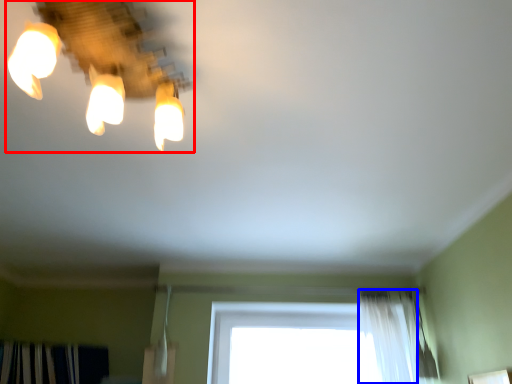
Question: Which object is further to the camera taking this photo, lamp (highlighted by a red box) or shower curtain (highlighted by a blue box)?

Choices:
 (A) lamp
 (B) shower curtain

Answer: (B)